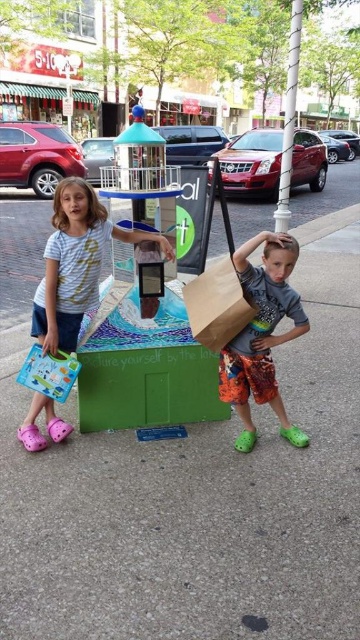
You are a photographer trying to capture the matte gray shirt at center and the brown paper bag at center in the same frame. Based on their positions, which object should you focus on first to ensure both are in the frame?

The matte gray shirt at center is located below the brown paper bag at center, so you should focus on the brown paper bag at center first to ensure both objects are captured in the frame.

You are a photographer trying to capture the matte white shirt at left in your shot. What are the coordinates where you should focus your camera?

The coordinates to focus on are (75, 262).

You are a photographer trying to capture the scene of the two children and the lighthouse. You notice the matte white shirt at left and the brown paper bag at center. Which object is blocking the view of the other?

The matte white shirt at left is positioned over the brown paper bag at center, so the matte white shirt at left is blocking the view of the brown paper bag at center.